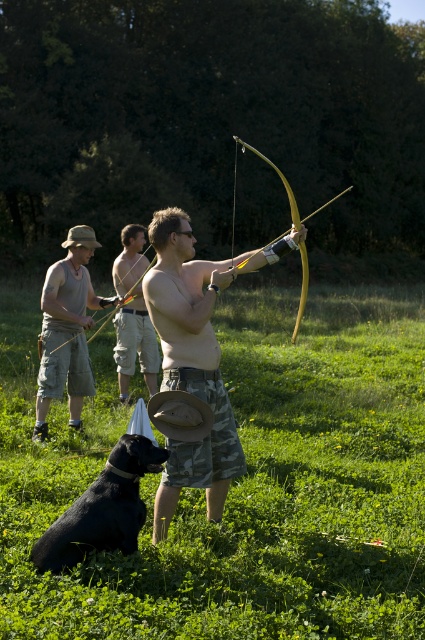
You are standing in the outdoor scene described. You want to place a small picnic blanket on the green grassy field at center and the black fur dog at lower left. Which location would be more suitable for the blanket in terms of height?

The green grassy field at center is taller than the black fur dog at lower left, so placing the picnic blanket there would be more suitable as it offers a higher elevation.

You are an observer standing in the outdoor scene. You notice the green grassy field at center and the matte beige tank top at center. Which object is wider?

The green grassy field at center is wider than the matte beige tank top at center according to the description provided.

You are standing at the point labeled point (146, 336) and want to walk to the point labeled point (345, 621). Which direction should you go relative to the black dog sitting in the foreground?

You should walk towards the direction of the black dog sitting in the foreground because point (345, 621) is in front of point (146, 336), meaning it is closer to the observer, which aligns with the dog being in the foreground.